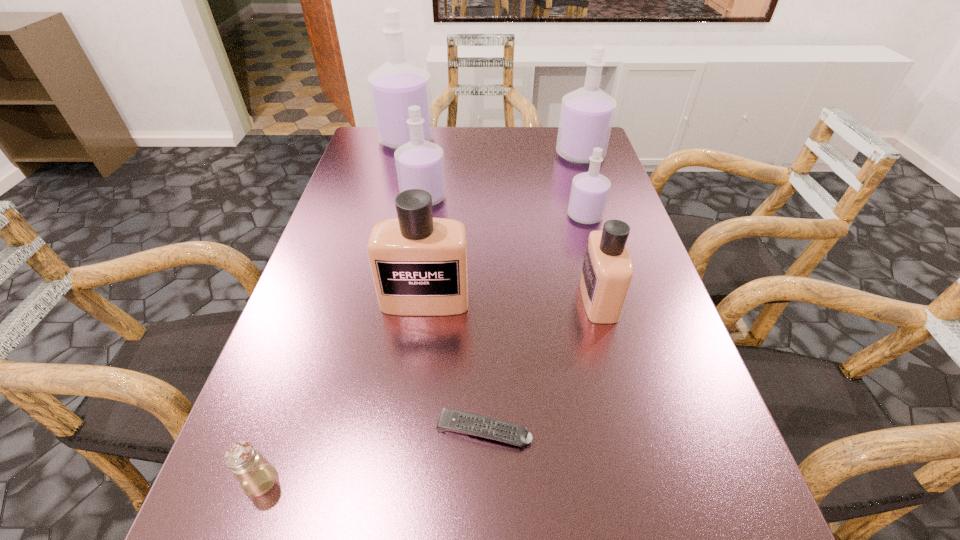
Locate an element on the screen. The height and width of the screenshot is (540, 960). free space located 0.060m on the right of the second shortest object is located at coordinates (320, 481).

Where is `vacant space positioned on the right of the seventh farthest object`? vacant space positioned on the right of the seventh farthest object is located at coordinates (680, 430).

This screenshot has width=960, height=540. Find the location of `saltshaker positioned at the left edge`. saltshaker positioned at the left edge is located at coordinates (256, 475).

Find the location of a particular element. This screenshot has height=540, width=960. object that is at the far left corner is located at coordinates (397, 84).

Where is `object that is at the far right corner`? Image resolution: width=960 pixels, height=540 pixels. object that is at the far right corner is located at coordinates (586, 117).

What are the coordinates of `vacant space at the far edge` in the screenshot? It's located at (473, 133).

You are a GUI agent. You are given a task and a screenshot of the screen. Output one action in this format:
    pyautogui.click(x=<x>, y=<y>)
    Task: Click on the vacant area at the left edge of the desktop
    This screenshot has height=540, width=960.
    Given the screenshot: What is the action you would take?
    pyautogui.click(x=326, y=274)

Find the location of `vacant area at the right edge of the desktop`. vacant area at the right edge of the desktop is located at coordinates (634, 266).

Locate an element on the screen. This screenshot has width=960, height=540. free region at the far left corner of the desktop is located at coordinates (369, 152).

The width and height of the screenshot is (960, 540). Find the location of `vacant space that is in between the bigger beige perfume and the right beige perfume`. vacant space that is in between the bigger beige perfume and the right beige perfume is located at coordinates (512, 300).